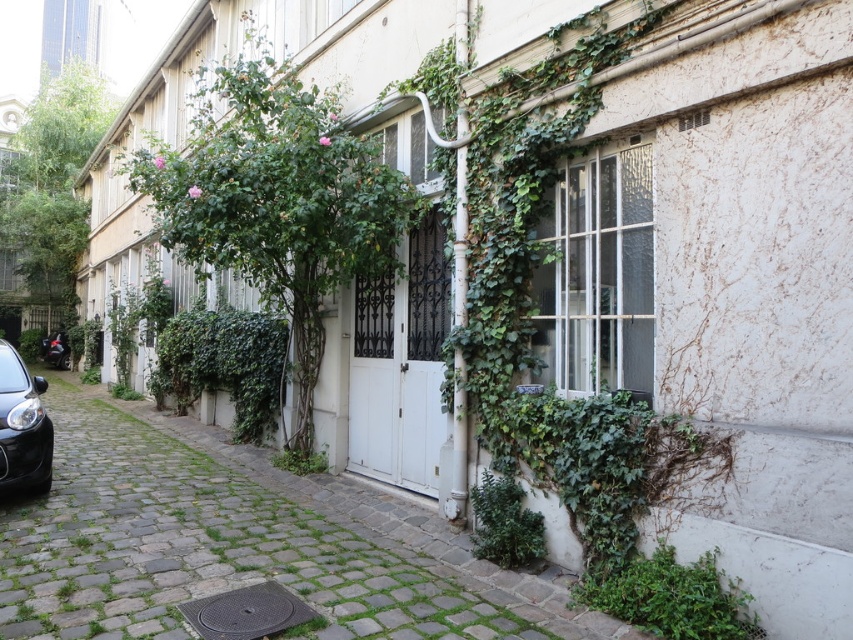
Question: Which point is farther to the camera?

Choices:
 (A) pyautogui.click(x=65, y=346)
 (B) pyautogui.click(x=520, y=538)
 (C) pyautogui.click(x=648, y=563)

Answer: (A)

Question: Among these points, which one is nearest to the camera?

Choices:
 (A) (312, 465)
 (B) (711, 593)
 (C) (4, 428)

Answer: (B)

Question: Is green leafy bush at lower right positioned in front of green leafy plant at center?

Choices:
 (A) yes
 (B) no

Answer: (A)

Question: Among these points, which one is nearest to the camera?

Choices:
 (A) (1, 346)
 (B) (281, 458)

Answer: (A)

Question: Is green leafy bush at lower right closer to camera compared to shiny black car at left?

Choices:
 (A) yes
 (B) no

Answer: (A)

Question: Can you confirm if green leafy bush at lower center is wider than green leafy plant at center?

Choices:
 (A) yes
 (B) no

Answer: (B)